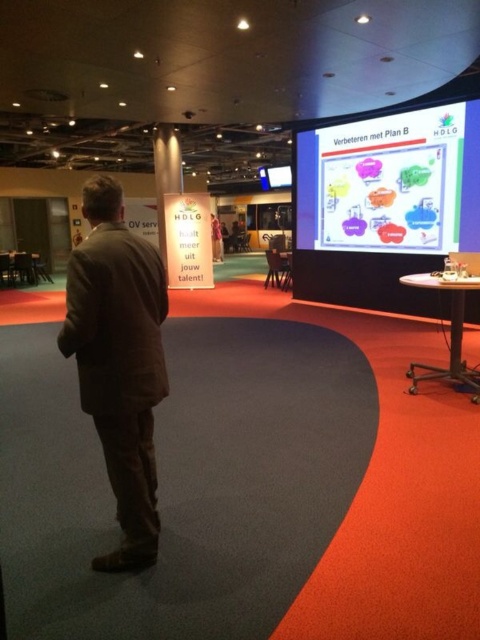
Is the position of brown fabric suit at left less distant than that of whiteboard at upper center?

Yes, it is in front of whiteboard at upper center.

Who is positioned more to the left, brown fabric suit at left or whiteboard at upper center?

Positioned to the left is brown fabric suit at left.

Is point (134, 492) farther from viewer compared to point (338, 244)?

No, it is in front of (338, 244).

Locate an element on the screen. brown fabric suit at left is located at coordinates (x=119, y=362).